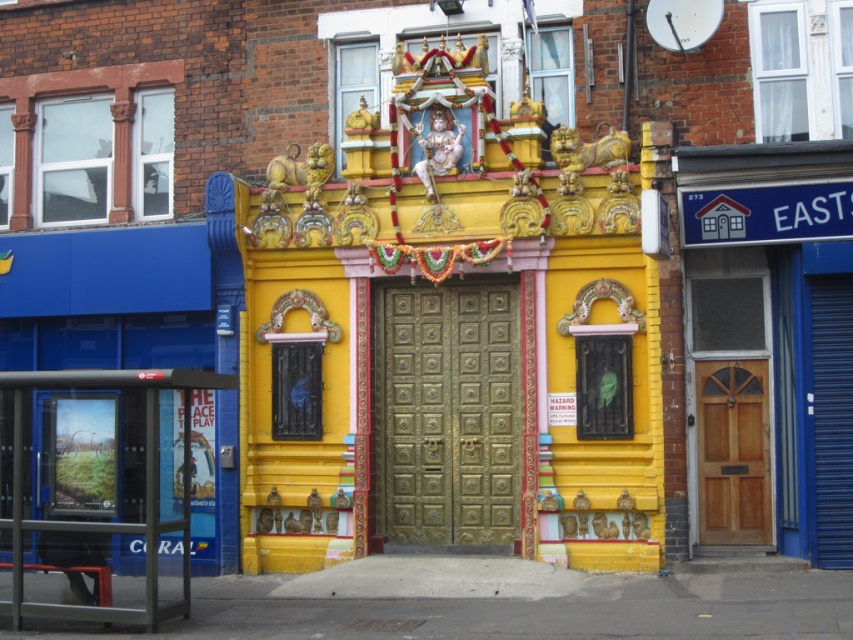
Which of these two, gold textured door at center or wooden door at center, stands taller?

gold textured door at center

Which is behind, point (521, 397) or point (753, 493)?

Positioned behind is point (521, 397).

Locate an element on the screen. The height and width of the screenshot is (640, 853). gold textured door at center is located at coordinates (448, 416).

Does metallic bus stop at lower left appear on the right side of wooden door at center?

Incorrect, metallic bus stop at lower left is not on the right side of wooden door at center.

Where is `metallic bus stop at lower left`? This screenshot has width=853, height=640. metallic bus stop at lower left is located at coordinates (108, 522).

Who is more forward, (384, 456) or (149, 518)?

Point (149, 518) is more forward.

Is gold textured door at center closer to camera compared to metallic bus stop at lower left?

No, it is not.

Identify the location of gold textured door at center. Image resolution: width=853 pixels, height=640 pixels. (448, 416).

Locate an element on the screen. The height and width of the screenshot is (640, 853). gold textured door at center is located at coordinates (448, 416).